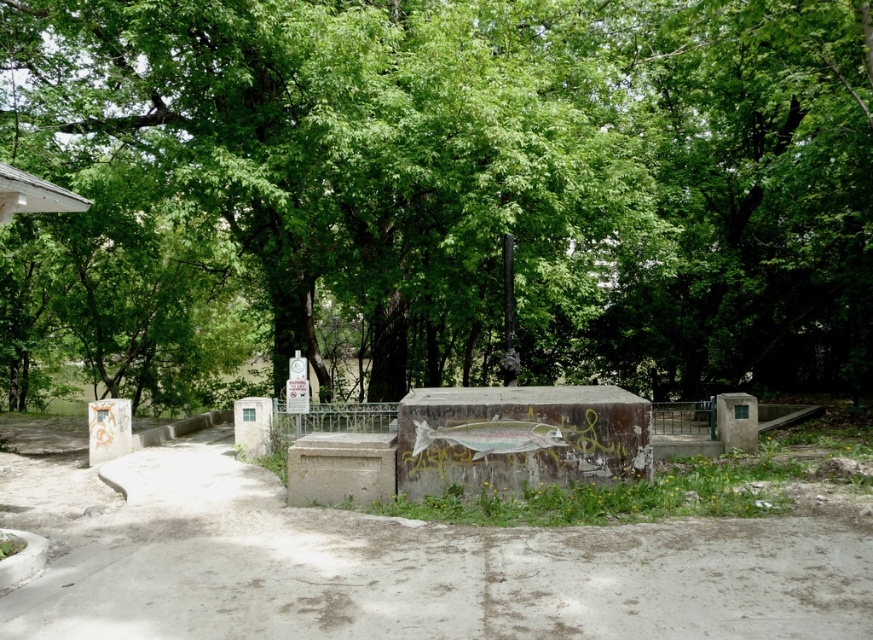
Question: Among these points, which one is farthest from the camera?

Choices:
 (A) (221, 33)
 (B) (641, 561)

Answer: (A)

Question: Which point is closer to the camera?

Choices:
 (A) green leafy tree at center
 (B) concrete at center

Answer: (B)

Question: Is the position of green leafy tree at center more distant than that of concrete at center?

Choices:
 (A) yes
 (B) no

Answer: (A)

Question: Can you confirm if green leafy tree at center is positioned below concrete at center?

Choices:
 (A) no
 (B) yes

Answer: (A)

Question: Does green leafy tree at center appear on the left side of concrete at center?

Choices:
 (A) yes
 (B) no

Answer: (B)